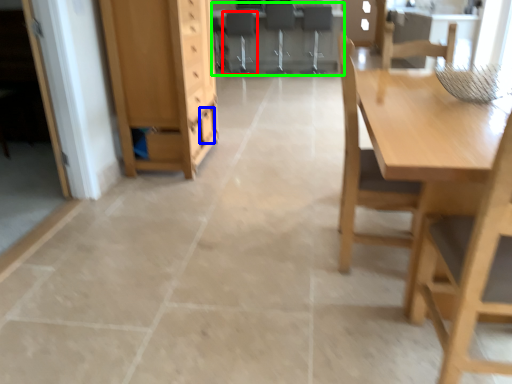
Question: Based on their relative distances, which object is farther from chair (highlighted by a red box)? Choose from drawer (highlighted by a blue box) and computer desk (highlighted by a green box).

Choices:
 (A) drawer
 (B) computer desk

Answer: (A)